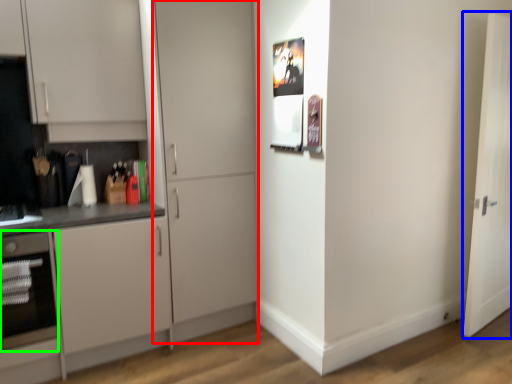
Question: Which object is positioned closest to door (highlighted by a red box)? Select from door (highlighted by a blue box) and oven (highlighted by a green box).

Choices:
 (A) door
 (B) oven

Answer: (B)